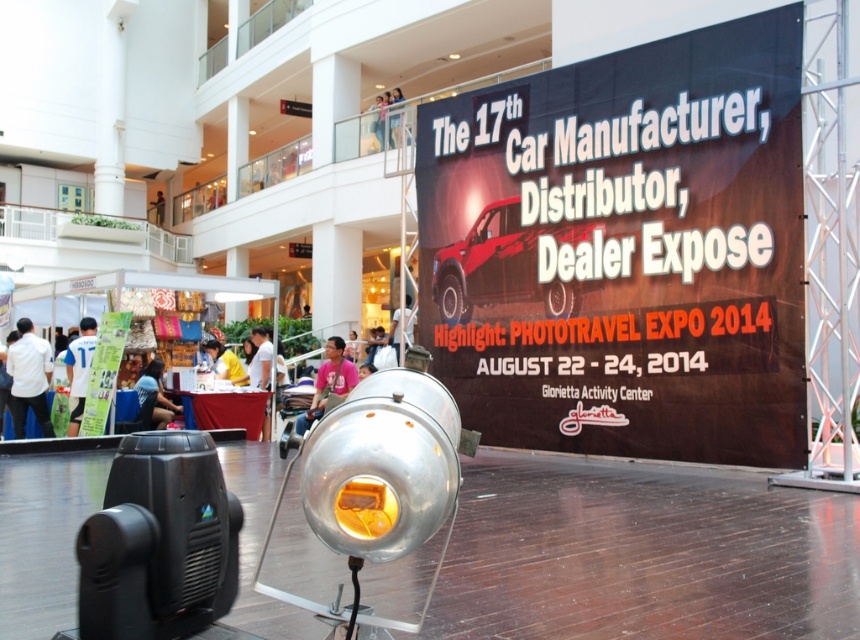
Question: Which point is closer to the camera taking this photo?

Choices:
 (A) (397, 88)
 (B) (422, 145)
 (C) (235, 378)
 (D) (88, 326)

Answer: (B)

Question: Which of these objects is positioned closest to the white jersey at left?

Choices:
 (A) light blue jeans at upper center
 (B) white shirt at lower left

Answer: (B)

Question: Is white shirt at lower left above light brown wooden chair at upper center?

Choices:
 (A) no
 (B) yes

Answer: (A)

Question: Among these points, which one is nearest to the camera?

Choices:
 (A) (152, 204)
 (B) (373, 120)

Answer: (B)

Question: Is the position of matte black banner at upper right more distant than that of light blue jeans at upper center?

Choices:
 (A) yes
 (B) no

Answer: (B)

Question: Is the position of yellow fabric at center less distant than that of light blue jeans at upper center?

Choices:
 (A) yes
 (B) no

Answer: (A)